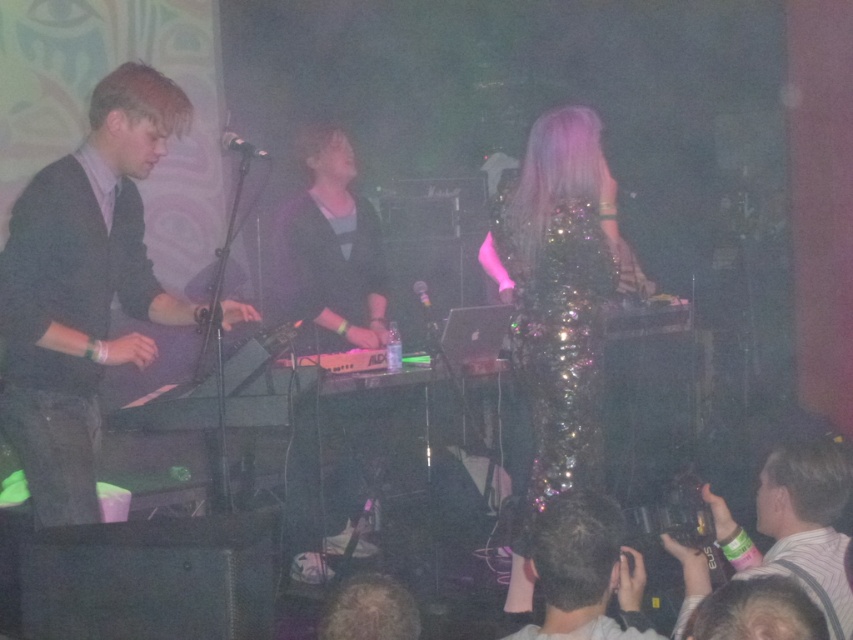
Question: Which is farther from the matte black keyboard at center?

Choices:
 (A) sparkly sequined dress at center
 (B) matte black suit at left

Answer: (B)

Question: Is matte black suit at left to the left of shiny sequined dress at center from the viewer's perspective?

Choices:
 (A) yes
 (B) no

Answer: (A)

Question: Can you confirm if matte black suit at left is bigger than sparkly sequined dress at center?

Choices:
 (A) yes
 (B) no

Answer: (B)

Question: Which point is closer to the camera?

Choices:
 (A) (300, 332)
 (B) (821, 452)
 (C) (550, 589)

Answer: (C)

Question: Does white striped shirt at lower right have a smaller size compared to shiny sequined dress at center?

Choices:
 (A) no
 (B) yes

Answer: (A)

Question: Considering the real-world distances, which object is farthest from the matte black keyboard at center?

Choices:
 (A) sparkly sequined dress at center
 (B) white striped shirt at lower right

Answer: (B)